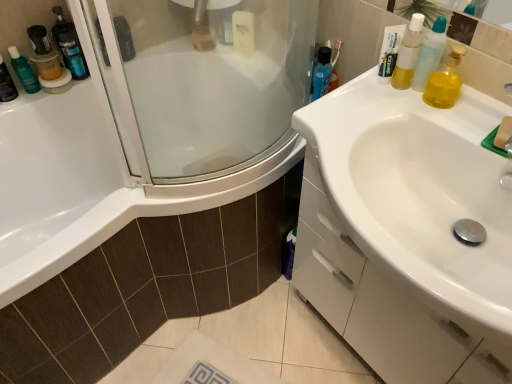
Question: Considering the relative sizes of translucent plastic mouthwash at upper right, the first mouthwash when ordered from front to back, and translucent plastic mouthwash at left, the 2th mouthwash viewed from the back, in the image provided, is translucent plastic mouthwash at upper right, the first mouthwash when ordered from front to back, smaller than translucent plastic mouthwash at left, the 2th mouthwash viewed from the back,?

Choices:
 (A) yes
 (B) no

Answer: (A)

Question: Would you say translucent plastic mouthwash at upper right, the first mouthwash when ordered from front to back, is a long distance from translucent plastic mouthwash at left, marked as the first mouthwash in a left-to-right arrangement?

Choices:
 (A) yes
 (B) no

Answer: (A)

Question: Considering the relative sizes of translucent plastic mouthwash at upper right, which is the first mouthwash in right-to-left order, and translucent plastic mouthwash at left, which appears as the 3th mouthwash when viewed from the front, in the image provided, is translucent plastic mouthwash at upper right, which is the first mouthwash in right-to-left order, bigger than translucent plastic mouthwash at left, which appears as the 3th mouthwash when viewed from the front,?

Choices:
 (A) no
 (B) yes

Answer: (A)

Question: Is translucent plastic mouthwash at upper right, which appears as the 4th mouthwash when viewed from the back, shorter than translucent plastic mouthwash at left, which appears as the 3th mouthwash when viewed from the front?

Choices:
 (A) no
 (B) yes

Answer: (B)

Question: Does translucent plastic mouthwash at upper right, which ranks as the fourth mouthwash in left-to-right order, appear on the left side of translucent plastic mouthwash at left, marked as the first mouthwash in a left-to-right arrangement?

Choices:
 (A) no
 (B) yes

Answer: (A)

Question: Relative to yellow translucent liquid at upper right, the second toiletry viewed from the back, is white glossy sink at right in front or behind?

Choices:
 (A) behind
 (B) front

Answer: (B)

Question: Visually, is white glossy sink at right positioned to the left or to the right of yellow translucent liquid at upper right, acting as the first toiletry starting from the right?

Choices:
 (A) left
 (B) right

Answer: (B)

Question: In terms of width, does white glossy sink at right look wider or thinner when compared to yellow translucent liquid at upper right, acting as the first toiletry starting from the right?

Choices:
 (A) wide
 (B) thin

Answer: (A)

Question: Is point (321, 264) closer or farther from the camera than point (438, 31)?

Choices:
 (A) farther
 (B) closer

Answer: (A)

Question: In terms of width, does translucent plastic mouthwash at left, which appears as the 3th mouthwash when viewed from the front, look wider or thinner when compared to translucent plastic container at upper left, the 2th toiletry viewed from the front?

Choices:
 (A) wide
 (B) thin

Answer: (A)

Question: From the image's perspective, relative to translucent plastic container at upper left, which appears as the second toiletry when viewed from the right, is translucent plastic mouthwash at left, the 2th mouthwash viewed from the back, above or below?

Choices:
 (A) below
 (B) above

Answer: (A)

Question: From their relative heights in the image, would you say translucent plastic mouthwash at left, the 2th mouthwash viewed from the back, is taller or shorter than translucent plastic container at upper left, the 2th toiletry viewed from the front?

Choices:
 (A) short
 (B) tall

Answer: (B)

Question: Based on their positions, is translucent plastic mouthwash at left, which appears as the 3th mouthwash when viewed from the front, located to the left or right of translucent plastic container at upper left, the 1th toiletry in the back-to-front sequence?

Choices:
 (A) left
 (B) right

Answer: (A)

Question: From the image's perspective, is translucent plastic container at upper left, which appears as the second toiletry when viewed from the right, located above or below translucent plastic mouthwash at left, the 2th mouthwash viewed from the back?

Choices:
 (A) below
 (B) above

Answer: (B)

Question: From a real-world perspective, is translucent plastic container at upper left, which appears as the second toiletry when viewed from the right, above or below translucent plastic mouthwash at left, the 2th mouthwash viewed from the back?

Choices:
 (A) below
 (B) above

Answer: (A)